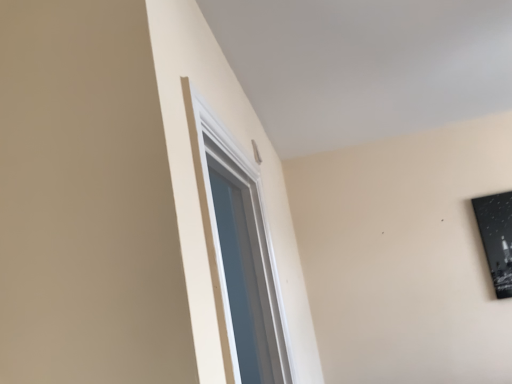
Image resolution: width=512 pixels, height=384 pixels. Describe the element at coordinates (238, 253) in the screenshot. I see `white plastic window at center` at that location.

You are a GUI agent. You are given a task and a screenshot of the screen. Output one action in this format:
    pyautogui.click(x=<x>, y=<y>)
    Task: Click on the white plastic window at center
    The image size is (512, 384).
    Given the screenshot: What is the action you would take?
    pyautogui.click(x=238, y=253)

Locate an element on the screen. The width and height of the screenshot is (512, 384). white plastic window at center is located at coordinates (238, 253).